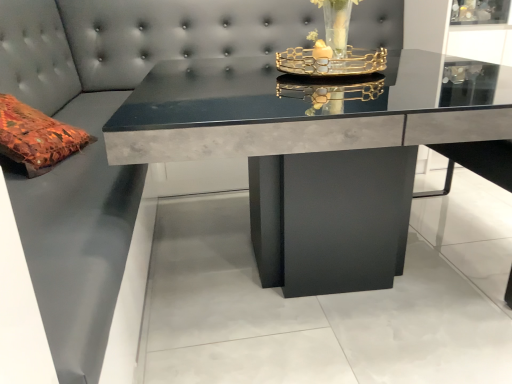
Describe the element at coordinates (331, 62) in the screenshot. I see `gold metallic tray at center` at that location.

You are a GUI agent. You are given a task and a screenshot of the screen. Output one action in this format:
    pyautogui.click(x=<x>, y=<y>)
    Task: Click on the gold metallic tray at center
    The height and width of the screenshot is (384, 512).
    Given the screenshot: What is the action you would take?
    pyautogui.click(x=331, y=62)

The image size is (512, 384). I want to click on matte concrete table at center, so click(317, 157).

Describe the element at coordinates (317, 157) in the screenshot. The width and height of the screenshot is (512, 384). I see `matte concrete table at center` at that location.

Where is `gold metallic tray at center`? gold metallic tray at center is located at coordinates pos(331,62).

Between matte concrete table at center and gold metallic tray at center, which one appears on the left side from the viewer's perspective?

From the viewer's perspective, matte concrete table at center appears more on the left side.

Which object is closer to the camera, matte concrete table at center or gold metallic tray at center?

matte concrete table at center is closer to the camera.

Which is behind, point (292, 112) or point (381, 55)?

Positioned behind is point (381, 55).

From the image's perspective, who appears lower, matte concrete table at center or gold metallic tray at center?

matte concrete table at center, from the image's perspective.

From a real-world perspective, is matte concrete table at center positioned above or below gold metallic tray at center?

matte concrete table at center is situated lower than gold metallic tray at center in the real world.

Is matte concrete table at center thinner than gold metallic tray at center?

In fact, matte concrete table at center might be wider than gold metallic tray at center.

Who is shorter, matte concrete table at center or gold metallic tray at center?

With less height is gold metallic tray at center.

Does matte concrete table at center have a larger size compared to gold metallic tray at center?

Yes, matte concrete table at center is bigger than gold metallic tray at center.

Is matte concrete table at center inside or outside of gold metallic tray at center?

matte concrete table at center lies outside gold metallic tray at center.

Is matte concrete table at center far from gold metallic tray at center?

matte concrete table at center is actually quite close to gold metallic tray at center.

Based on the photo, is matte concrete table at center oriented away from gold metallic tray at center?

No, matte concrete table at center is not facing away from gold metallic tray at center.

This screenshot has height=384, width=512. Identify the location of candle holder that appears above the matte concrete table at center (from a real-world perspective). (x=331, y=62).

Considering the positions of objects gold metallic tray at center and matte concrete table at center in the image provided, who is more to the right, gold metallic tray at center or matte concrete table at center?

Positioned to the right is gold metallic tray at center.

Is gold metallic tray at center positioned in front of matte concrete table at center?

No, it is not.

Does point (336, 61) come behind point (270, 192)?

Yes, point (336, 61) is behind point (270, 192).

From the image's perspective, who appears lower, gold metallic tray at center or matte concrete table at center?

matte concrete table at center is shown below in the image.

From a real-world perspective, is gold metallic tray at center over matte concrete table at center?

Yes, from a real-world perspective, gold metallic tray at center is above matte concrete table at center.

Which object is wider, gold metallic tray at center or matte concrete table at center?

matte concrete table at center.

Considering the sizes of objects gold metallic tray at center and matte concrete table at center in the image provided, who is shorter, gold metallic tray at center or matte concrete table at center?

Standing shorter between the two is gold metallic tray at center.

Who is bigger, gold metallic tray at center or matte concrete table at center?

matte concrete table at center.

Do you think gold metallic tray at center is within matte concrete table at center, or outside of it?

gold metallic tray at center cannot be found inside matte concrete table at center.

Would you say gold metallic tray at center is a long distance from matte concrete table at center?

They are positioned close to each other.

From the picture: Is gold metallic tray at center oriented towards matte concrete table at center?

No, gold metallic tray at center does not turn towards matte concrete table at center.

What's the angular difference between gold metallic tray at center and matte concrete table at center's facing directions?

3.62 degrees separate the facing orientations of gold metallic tray at center and matte concrete table at center.

How far apart are gold metallic tray at center and matte concrete table at center?

gold metallic tray at center and matte concrete table at center are 38.62 centimeters apart from each other.

Where is `table beneath the gold metallic tray at center (from a real-world perspective)`? table beneath the gold metallic tray at center (from a real-world perspective) is located at coordinates (317, 157).

I want to click on candle holder on the right of matte concrete table at center, so click(x=331, y=62).

Image resolution: width=512 pixels, height=384 pixels. In order to click on table in front of the gold metallic tray at center in this screenshot , I will do `click(317, 157)`.